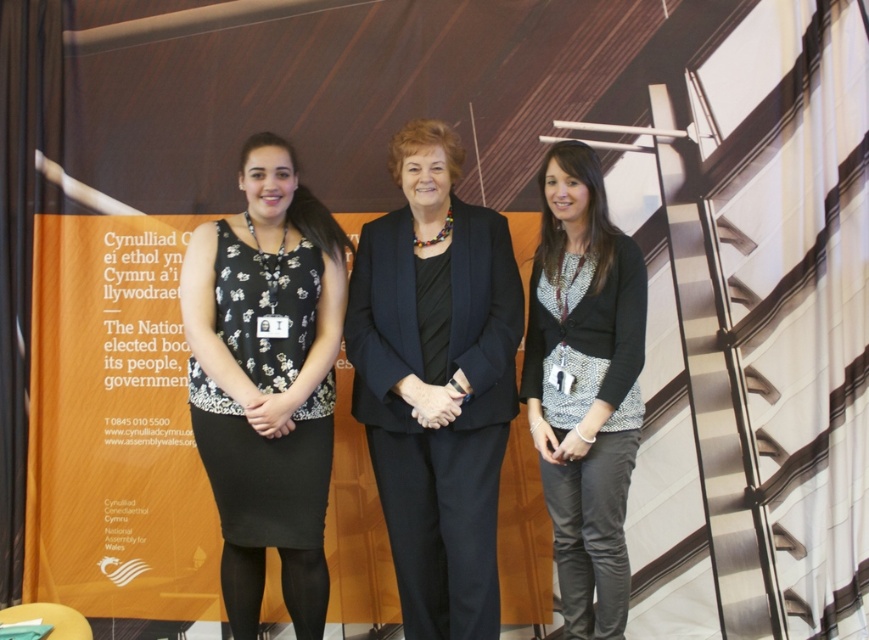
You are a photographer setting up for a group photo. You notice two outfits in the scene, the black fabric suit at center and the black matte dress at left. Which outfit is taller in the image?

The black fabric suit at center is taller than the black matte dress at left according to the description.

Based on the photo, you are standing in front of the backdrop with the text and architectural design. You notice two points marked on the image. Which point is closer to you, point (463, 634) or point (574, 554)?

Point (463, 634) is in front of point (574, 554), so it is closer to you.

You are standing 10 feet away from the backdrop. If you move forward 0.5 feet, will you be closer to the point at coordinates point (512, 314) than the backdrop?

The distance of point (512, 314) from viewer is 9.48 feet. After moving forward 0.5 feet, you will be 9.48 feet away from the point and 9.5 feet away from the backdrop. Therefore, you will be closer to the point than the backdrop.